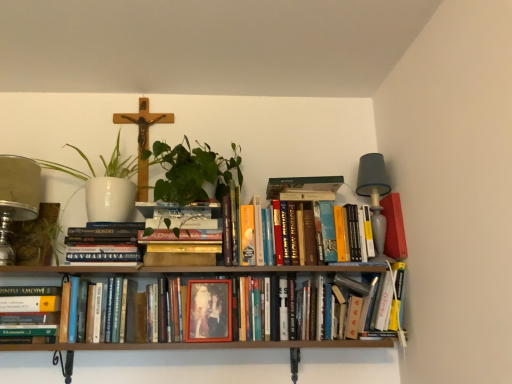
Question: Is wooden frame photo at center, which is the 3th book in left-to-right order, inside or outside of gray fabric lampshade at upper right, marked as the 1th table lamp in a right-to-left arrangement?

Choices:
 (A) outside
 (B) inside

Answer: (A)

Question: Considering the positions of wooden frame photo at center, arranged as the second book when viewed from the right, and gray fabric lampshade at upper right, arranged as the 2th table lamp when viewed from the left, in the image, is wooden frame photo at center, arranged as the second book when viewed from the right, taller or shorter than gray fabric lampshade at upper right, arranged as the 2th table lamp when viewed from the left,?

Choices:
 (A) short
 (B) tall

Answer: (A)

Question: Which object is positioned closest to the wooden crucifix at upper center?

Choices:
 (A) matte red paperback book at right, positioned as the 2th paperback book in left-to-right order
 (B) hardcover books at center, marked as the 2th book in a left-to-right arrangement
 (C) wooden frame photo at center, arranged as the second book when viewed from the right
 (D) hardcover books at center, which is the fourth book from left to right
 (E) hardcover book at lower left, acting as the fourth book starting from the right

Answer: (B)

Question: Which object is the closest to the gray fabric lampshade at upper right, marked as the 1th table lamp in a right-to-left arrangement?

Choices:
 (A) metallic glass table lamp at left, the first table lamp from the left
 (B) hardcover book at lower left, acting as the 1th book starting from the left
 (C) wooden frame photo at center, arranged as the second book when viewed from the right
 (D) matte plastic photo frame at center, which is counted as the 2th paperback book, starting from the back
 (E) matte red paperback book at right, acting as the first paperback book starting from the right

Answer: (E)